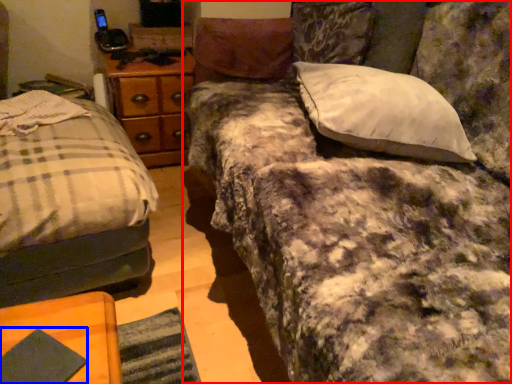
Question: Which object appears farthest to the camera in this image, studio couch (highlighted by a red box) or pad (highlighted by a blue box)?

Choices:
 (A) studio couch
 (B) pad

Answer: (B)